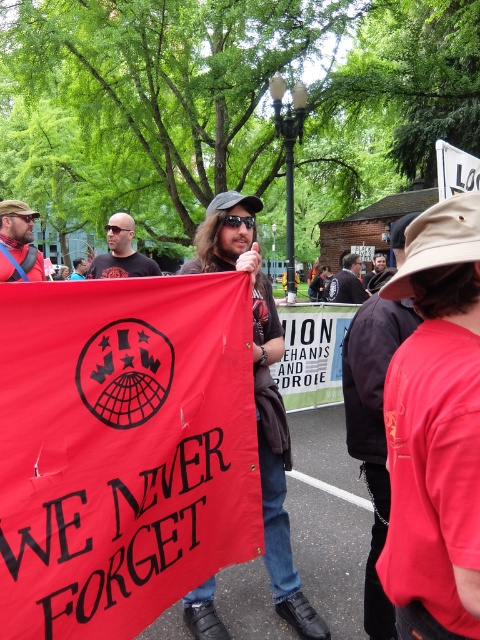
Question: Does matte black shirt at center have a greater width compared to matte black sunglasses at center?

Choices:
 (A) no
 (B) yes

Answer: (A)

Question: Which object is farther from the camera taking this photo?

Choices:
 (A) matte black sunglasses at center
 (B) red fabric banner at center
 (C) red cotton shirt at center

Answer: (B)

Question: Which of the following is the closest to the observer?

Choices:
 (A) (343, 308)
 (B) (283, 435)

Answer: (B)

Question: Is red matte banner at center closer to camera compared to matte black cap at upper left?

Choices:
 (A) no
 (B) yes

Answer: (B)

Question: Can you confirm if red matte banner at center is bigger than matte black shirt at center?

Choices:
 (A) yes
 (B) no

Answer: (B)

Question: Which of the following is the farthest from the observer?

Choices:
 (A) red fabric banner at center
 (B) matte black cap at upper left
 (C) matte black sunglasses at center
 (D) red cotton shirt at center

Answer: (A)